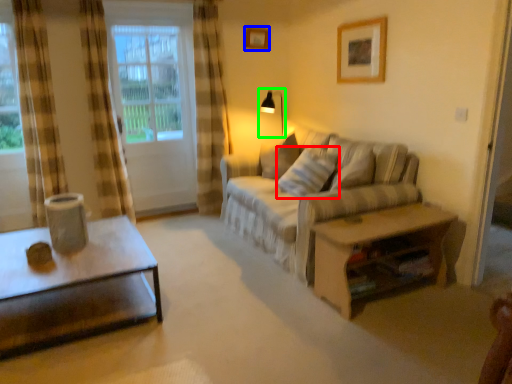
Question: Considering the real-world distances, which object is closest to pillow (highlighted by a red box)? picture frame (highlighted by a blue box) or table lamp (highlighted by a green box).

Choices:
 (A) picture frame
 (B) table lamp

Answer: (B)